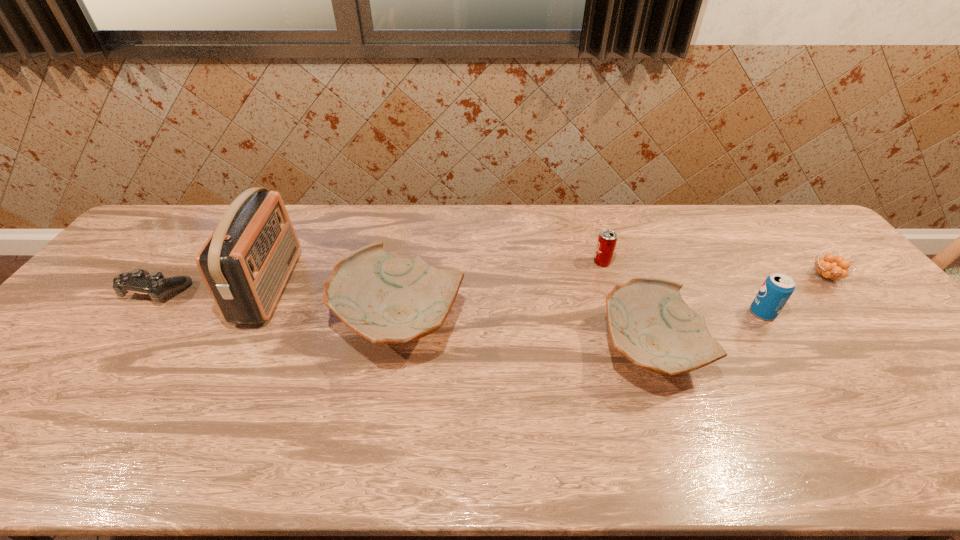
Locate an element on the screen. The image size is (960, 540). free point between the orange fruit and the second object from right to left is located at coordinates (794, 295).

Locate an element on the screen. The height and width of the screenshot is (540, 960). object that can be found as the fifth closest to the left pottery is located at coordinates (777, 288).

Choose which object is the fifth nearest neighbor to the fifth object from right to left. Please provide its 2D coordinates. Your answer should be formatted as a tuple, i.e. [(x, y)], where the tuple contains the x and y coordinates of a point satisfying the conditions above.

[(777, 288)]

You are a GUI agent. You are given a task and a screenshot of the screen. Output one action in this format:
    pyautogui.click(x=<x>, y=<y>)
    Task: Click on the vacant space that satisfies the following two spatial constraints: 1. on the front side of the right pottery; 2. on the left side of the taller pottery
    This screenshot has width=960, height=540.
    Given the screenshot: What is the action you would take?
    pyautogui.click(x=395, y=350)

Locate an element on the screen. This screenshot has width=960, height=540. vacant position in the image that satisfies the following two spatial constraints: 1. on the front-facing side of the left pottery; 2. on the left side of the tallest object is located at coordinates (252, 322).

Identify the location of vacant position in the image that satisfies the following two spatial constraints: 1. on the front side of the beer can; 2. on the right side of the orange fruit. The width and height of the screenshot is (960, 540). (607, 276).